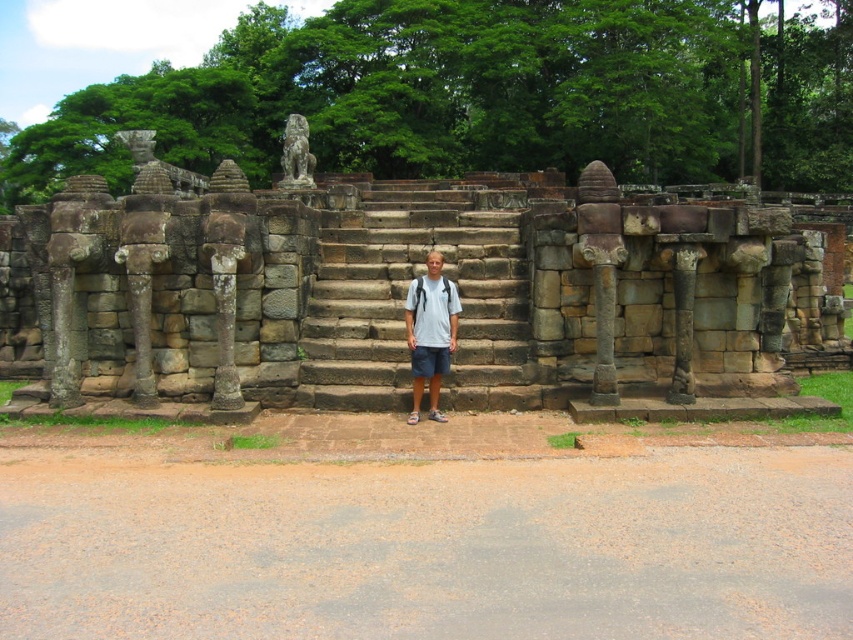
Question: Does stone wall at center have a lesser width compared to brown stone stairs at center?

Choices:
 (A) yes
 (B) no

Answer: (B)

Question: In this image, where is white cotton shirt at center located relative to dark blue cotton shorts at center?

Choices:
 (A) above
 (B) below

Answer: (A)

Question: Can you confirm if brown stone stairs at center is smaller than dark blue cotton shorts at center?

Choices:
 (A) no
 (B) yes

Answer: (A)

Question: Which point appears farthest from the camera in this image?

Choices:
 (A) (532, 396)
 (B) (422, 358)

Answer: (A)

Question: Which object is the closest to the stone wall at center?

Choices:
 (A) brown stone stairs at center
 (B) dark blue cotton shorts at center
 (C) white cotton shirt at center

Answer: (A)

Question: Which of the following is the farthest from the observer?

Choices:
 (A) (419, 308)
 (B) (415, 362)

Answer: (A)